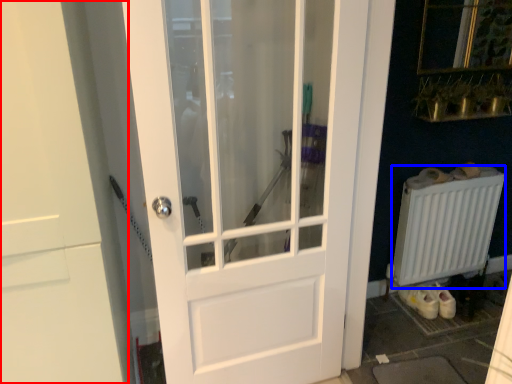
Question: Which point is closer to the camera, door (highlighted by a red box) or radiator (highlighted by a blue box)?

Choices:
 (A) door
 (B) radiator

Answer: (A)